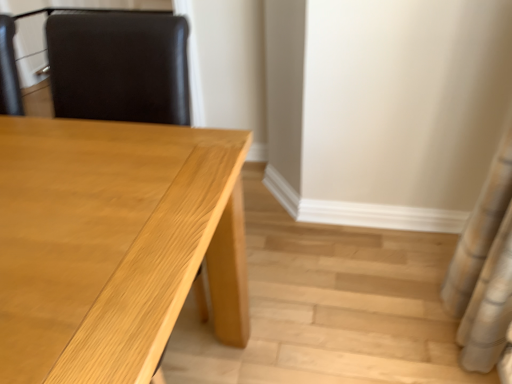
This screenshot has height=384, width=512. I want to click on light wood table at center, so click(113, 244).

This screenshot has width=512, height=384. What do you see at coordinates (113, 244) in the screenshot?
I see `light wood table at center` at bounding box center [113, 244].

What do you see at coordinates (486, 273) in the screenshot? I see `white textured shower curtain at right` at bounding box center [486, 273].

Find the location of a particular element. Image resolution: width=512 pixels, height=384 pixels. white textured shower curtain at right is located at coordinates click(486, 273).

Find the location of a particular element. This screenshot has width=512, height=384. light wood table at center is located at coordinates (113, 244).

Is light wood table at center to the right of white textured shower curtain at right from the viewer's perspective?

No.

Does light wood table at center lie behind white textured shower curtain at right?

No, light wood table at center is closer to the viewer.

Considering the positions of point (46, 237) and point (494, 179), is point (46, 237) closer or farther from the camera than point (494, 179)?

Point (46, 237).

From the image's perspective, is light wood table at center above or below white textured shower curtain at right?

Clearly, from the image's perspective, light wood table at center is below white textured shower curtain at right.

From a real-world perspective, is light wood table at center on white textured shower curtain at right?

No, from a real-world perspective, light wood table at center is not on top of white textured shower curtain at right.

Which object is wider, light wood table at center or white textured shower curtain at right?

With larger width is light wood table at center.

Who is shorter, light wood table at center or white textured shower curtain at right?

Standing shorter between the two is light wood table at center.

Considering the relative sizes of light wood table at center and white textured shower curtain at right in the image provided, is light wood table at center smaller than white textured shower curtain at right?

Incorrect, light wood table at center is not smaller in size than white textured shower curtain at right.

Looking at this image, choose the correct answer: Is light wood table at center inside white textured shower curtain at right or outside it?

light wood table at center is outside white textured shower curtain at right.

Is light wood table at center next to white textured shower curtain at right and touching it?

light wood table at center is not next to white textured shower curtain at right, and they're not touching.

Could you tell me if light wood table at center is turned towards white textured shower curtain at right?

No, light wood table at center does not turn towards white textured shower curtain at right.

What's the angular difference between light wood table at center and white textured shower curtain at right's facing directions?

light wood table at center and white textured shower curtain at right are facing 92 degrees away from each other.

Locate an element on the screen. Image resolution: width=512 pixels, height=384 pixels. shower curtain behind the light wood table at center is located at coordinates (486, 273).

Which is more to the right, white textured shower curtain at right or light wood table at center?

Positioned to the right is white textured shower curtain at right.

Who is more distant, white textured shower curtain at right or light wood table at center?

white textured shower curtain at right is further away from the camera.

Which is nearer, (500, 153) or (129, 180)?

The point (129, 180) is closer to the camera.

From the image's perspective, is white textured shower curtain at right over light wood table at center?

Yes, from the image's perspective, white textured shower curtain at right is over light wood table at center.

From a real-world perspective, does white textured shower curtain at right stand above light wood table at center?

Yes, from a real-world perspective, white textured shower curtain at right is over light wood table at center

Considering the sizes of white textured shower curtain at right and light wood table at center in the image, is white textured shower curtain at right wider or thinner than light wood table at center?

white textured shower curtain at right is thinner than light wood table at center.

Considering the relative sizes of white textured shower curtain at right and light wood table at center in the image provided, is white textured shower curtain at right shorter than light wood table at center?

In fact, white textured shower curtain at right may be taller than light wood table at center.

Considering the sizes of objects white textured shower curtain at right and light wood table at center in the image provided, who is smaller, white textured shower curtain at right or light wood table at center?

Smaller between the two is white textured shower curtain at right.

Is white textured shower curtain at right inside the boundaries of light wood table at center, or outside?

white textured shower curtain at right is outside light wood table at center.

Is white textured shower curtain at right positioned far away from light wood table at center?

No, white textured shower curtain at right is not far away from light wood table at center.

Could you tell me if white textured shower curtain at right is facing light wood table at center?

Yes, white textured shower curtain at right is turned towards light wood table at center.

Where is `shower curtain that is above the light wood table at center (from a real-world perspective)`? The width and height of the screenshot is (512, 384). shower curtain that is above the light wood table at center (from a real-world perspective) is located at coordinates (486, 273).

In the image, there is a white textured shower curtain at right. In order to click on table below it (from a real-world perspective) in this screenshot , I will do `click(113, 244)`.

I want to click on shower curtain above the light wood table at center (from a real-world perspective), so click(x=486, y=273).